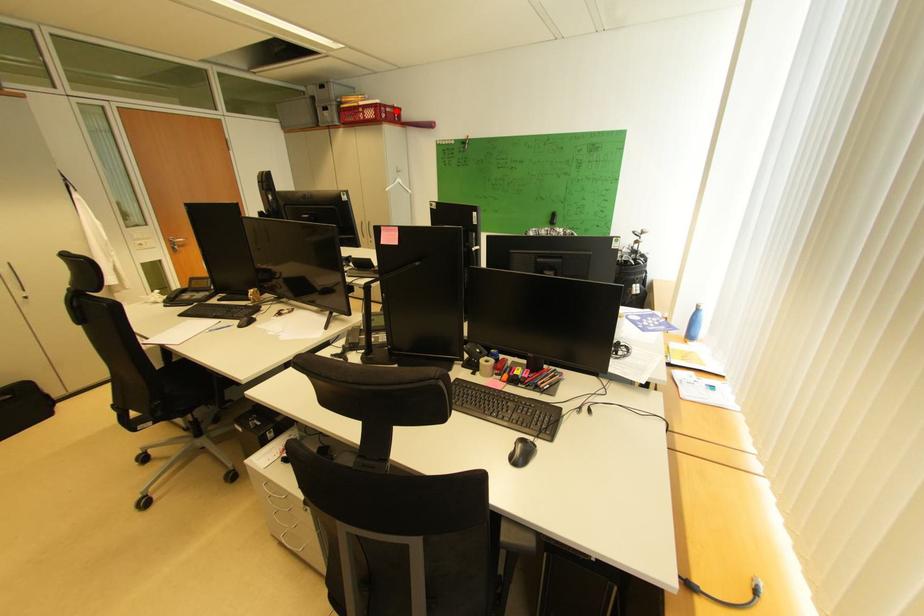
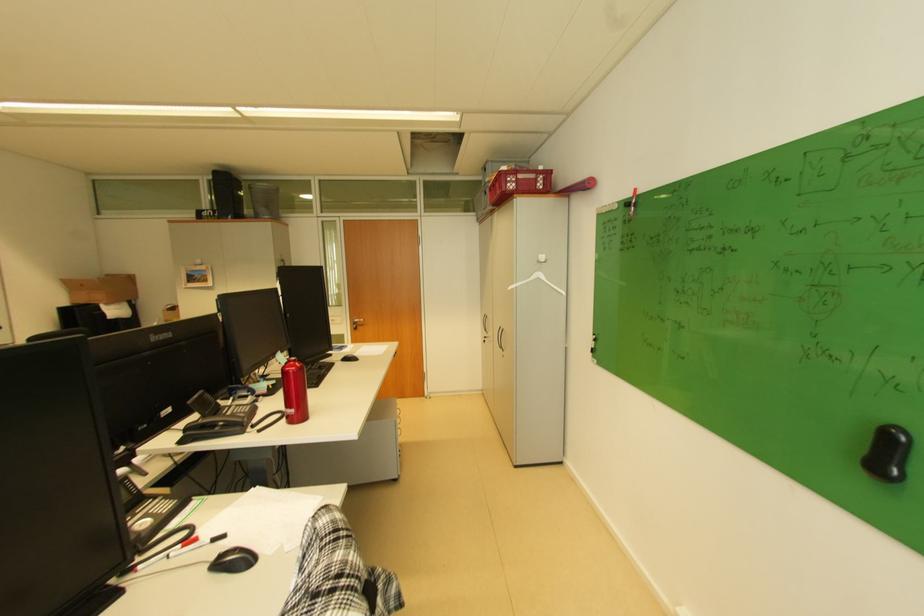
The point at the highlighted location is marked in the first image. Where is the corresponding point in the second image?

(529, 177)